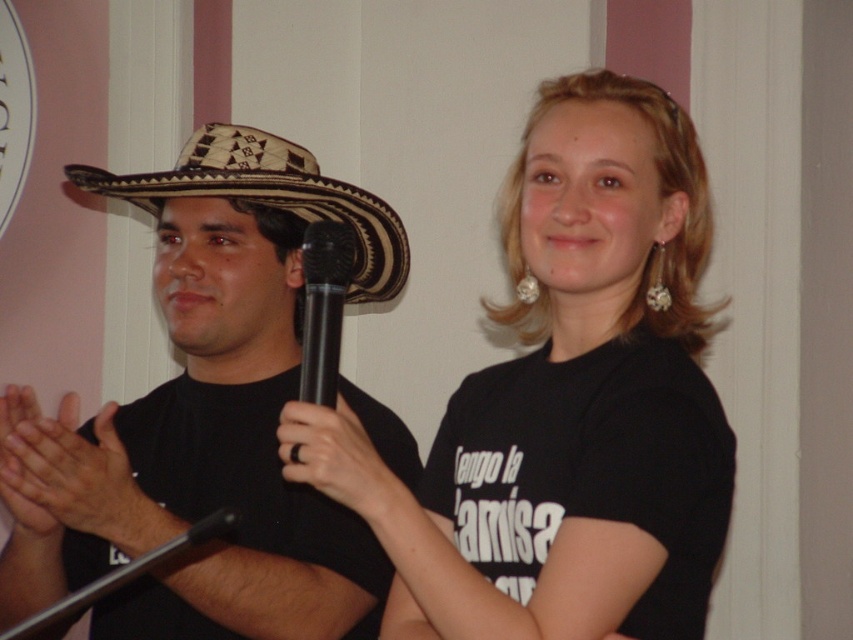
Question: Is smooth skin hands at center smaller than woven straw cowboy hat at left?

Choices:
 (A) yes
 (B) no

Answer: (A)

Question: Among these objects, which one is farthest from the camera?

Choices:
 (A) smooth skin hands at center
 (B) natural straw hat at left
 (C) black matte shirt at center
 (D) black matte ring at center

Answer: (B)

Question: Considering the real-world distances, which object is closest to the smooth skin hands at center?

Choices:
 (A) black plastic microphone at center
 (B) woven straw cowboy hat at left

Answer: (A)

Question: Which object appears closest to the camera in this image?

Choices:
 (A) black matte ring at center
 (B) woven straw cowboy hat at left
 (C) smooth skin hands at center
 (D) black plastic microphone at center

Answer: (A)

Question: In this image, where is natural straw hat at left located relative to black matte ring at center?

Choices:
 (A) left
 (B) right

Answer: (A)

Question: Is black matte ring at center below black plastic microphone at center?

Choices:
 (A) no
 (B) yes

Answer: (B)